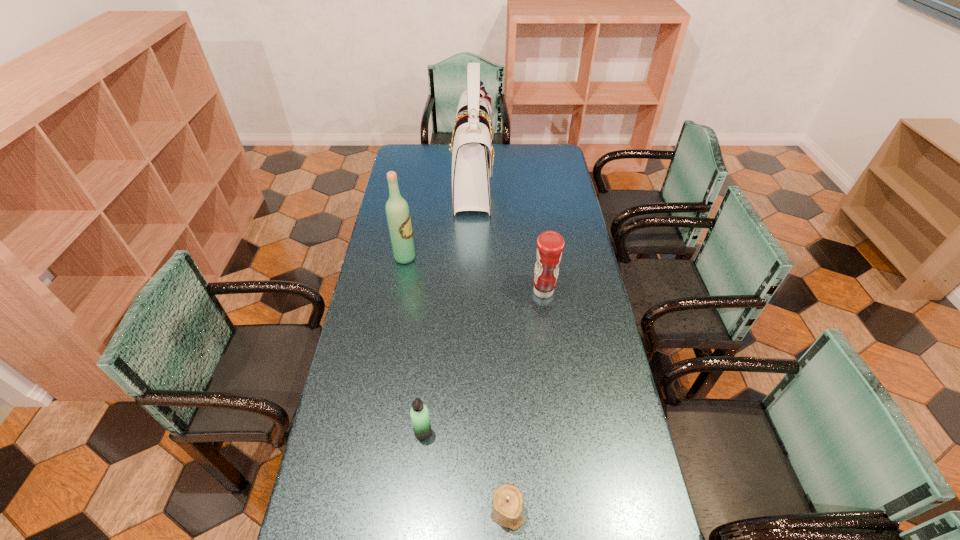
Image resolution: width=960 pixels, height=540 pixels. I want to click on vacant area situated on the front-facing side of the tallest object, so click(x=555, y=182).

Locate an element on the screen. blank space located on the front-facing side of the second farthest object is located at coordinates (477, 258).

Locate an element on the screen. The width and height of the screenshot is (960, 540). vacant area located 0.240m on the front of the third nearest object is located at coordinates (553, 360).

You are a GUI agent. You are given a task and a screenshot of the screen. Output one action in this format:
    pyautogui.click(x=<x>, y=<y>)
    Task: Click on the vacant space located on the left of the second nearest object
    
    Given the screenshot: What is the action you would take?
    pyautogui.click(x=360, y=432)

Where is `free spot located on the right of the shortest object`? The width and height of the screenshot is (960, 540). free spot located on the right of the shortest object is located at coordinates (558, 512).

This screenshot has width=960, height=540. In order to click on object at the far edge in this screenshot , I will do `click(472, 154)`.

In order to click on object that is positioned at the left edge in this screenshot , I will do [x=397, y=211].

Where is `object located at the right edge`? object located at the right edge is located at coordinates (550, 244).

Where is `free space at the left edge of the desktop`? The width and height of the screenshot is (960, 540). free space at the left edge of the desktop is located at coordinates (371, 380).

Where is `vacant space at the far left corner of the desktop`? Image resolution: width=960 pixels, height=540 pixels. vacant space at the far left corner of the desktop is located at coordinates (417, 158).